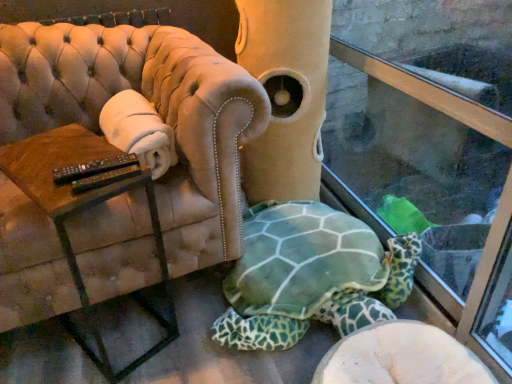
Describe the element at coordinates (84, 209) in the screenshot. I see `brown wooden table at left` at that location.

At what (x,y) coordinates should I click in order to perform the action: click on velvet beige armchair at center. Please return your answer as a coordinate pair (x, y). This screenshot has height=384, width=512. Looking at the image, I should click on (155, 107).

I want to click on green fabric tortoise at center, so click(310, 276).

You are a GUI agent. You are given a task and a screenshot of the screen. Output one action in this format:
    pyautogui.click(x=<x>, y=<y>)
    Task: Click on the brown wooden table at left
    The height and width of the screenshot is (384, 512).
    Given the screenshot: What is the action you would take?
    pyautogui.click(x=84, y=209)

From the image's perspective, which one is positioned lower, green fabric tortoise at center or transparent glass shop window at lower right?

From the image's view, green fabric tortoise at center is below.

From a real-world perspective, is green fabric tortoise at center below transparent glass shop window at lower right?

Yes, from a real-world perspective, green fabric tortoise at center is below transparent glass shop window at lower right.

Is green fabric tortoise at center inside the boundaries of transparent glass shop window at lower right, or outside?

green fabric tortoise at center exists outside the volume of transparent glass shop window at lower right.

Is velvet beige armchair at center positioned in front of transparent glass shop window at lower right?

No, it is not.

Based on the photo, is velvet beige armchair at center aimed at transparent glass shop window at lower right?

No, velvet beige armchair at center is not oriented towards transparent glass shop window at lower right.

Considering the points (120, 84) and (497, 123), which point is behind, point (120, 84) or point (497, 123)?

Positioned behind is point (120, 84).

Considering the sizes of objects velvet beige armchair at center and transparent glass shop window at lower right in the image provided, who is smaller, velvet beige armchair at center or transparent glass shop window at lower right?

With smaller size is transparent glass shop window at lower right.

Based on the photo, does transparent glass shop window at lower right turn towards velvet beige armchair at center?

Yes, transparent glass shop window at lower right is turned towards velvet beige armchair at center.

Looking at the image, does transparent glass shop window at lower right seem bigger or smaller compared to velvet beige armchair at center?

Clearly, transparent glass shop window at lower right is smaller in size than velvet beige armchair at center.

Is transparent glass shop window at lower right touching velvet beige armchair at center?

They are not placed beside each other.

Is transparent glass shop window at lower right to the left or to the right of velvet beige armchair at center in the image?

transparent glass shop window at lower right is to the right of velvet beige armchair at center.

From the image's perspective, is brown wooden table at left above or below green fabric tortoise at center?

brown wooden table at left is situated higher than green fabric tortoise at center in the image.

From a real-world perspective, does brown wooden table at left sit lower than green fabric tortoise at center?

No, from a real-world perspective, brown wooden table at left is not beneath green fabric tortoise at center.

Between brown wooden table at left and green fabric tortoise at center, which one has larger size?

green fabric tortoise at center is bigger.

Measure the distance from brown wooden table at left to green fabric tortoise at center.

brown wooden table at left and green fabric tortoise at center are 20.20 inches apart.

Choose the correct answer: Is green fabric tortoise at center inside velvet beige armchair at center or outside it?

green fabric tortoise at center is spatially situated outside velvet beige armchair at center.

How many degrees apart are the facing directions of green fabric tortoise at center and velvet beige armchair at center?

The angle between the facing direction of green fabric tortoise at center and the facing direction of velvet beige armchair at center is 5.84 degrees.

Is green fabric tortoise at center to the left of velvet beige armchair at center from the viewer's perspective?

In fact, green fabric tortoise at center is to the right of velvet beige armchair at center.

From their relative heights in the image, would you say green fabric tortoise at center is taller or shorter than velvet beige armchair at center?

In the image, green fabric tortoise at center appears to be shorter than velvet beige armchair at center.

Based on the photo, measure the distance between brown wooden table at left and transparent glass shop window at lower right.

A distance of 38.90 inches exists between brown wooden table at left and transparent glass shop window at lower right.

Is brown wooden table at left touching transparent glass shop window at lower right?

No, brown wooden table at left is not in contact with transparent glass shop window at lower right.

Is brown wooden table at left bigger or smaller than transparent glass shop window at lower right?

In the image, brown wooden table at left appears to be larger than transparent glass shop window at lower right.

What's the angular difference between brown wooden table at left and transparent glass shop window at lower right's facing directions?

63.4 degrees.

Is velvet beige armchair at center spatially inside brown wooden table at left, or outside of it?

velvet beige armchair at center lies outside brown wooden table at left.

Between velvet beige armchair at center and brown wooden table at left, which one appears on the left side from the viewer's perspective?

velvet beige armchair at center is more to the left.

Is velvet beige armchair at center directly adjacent to brown wooden table at left?

No, velvet beige armchair at center is not beside brown wooden table at left.

Locate an element on the screen. shop window to the right of green fabric tortoise at center is located at coordinates (426, 92).

Find the location of `shop window positioned vertically above the velvet beige armchair at center (from a real-world perspective)`. shop window positioned vertically above the velvet beige armchair at center (from a real-world perspective) is located at coordinates (426, 92).

Which object lies nearer to the anchor point transparent glass shop window at lower right, brown wooden table at left or velvet beige armchair at center?

velvet beige armchair at center is closer to transparent glass shop window at lower right.

From the picture: Estimate the real-world distances between objects in this image. Which object is closer to velvet beige armchair at center, green fabric tortoise at center or brown wooden table at left?

The object closer to velvet beige armchair at center is brown wooden table at left.

Considering their positions, is transparent glass shop window at lower right positioned closer to green fabric tortoise at center than velvet beige armchair at center?

transparent glass shop window at lower right is positioned closer to the anchor green fabric tortoise at center.

Considering their positions, is brown wooden table at left positioned closer to velvet beige armchair at center than green fabric tortoise at center?

The object closer to velvet beige armchair at center is brown wooden table at left.

Consider the image. Estimate the real-world distances between objects in this image. Which object is closer to brown wooden table at left, velvet beige armchair at center or transparent glass shop window at lower right?

velvet beige armchair at center is closer to brown wooden table at left.

Consider the image. Based on their spatial positions, is brown wooden table at left or velvet beige armchair at center further from green fabric tortoise at center?

brown wooden table at left.

When comparing their distances from green fabric tortoise at center, does brown wooden table at left or transparent glass shop window at lower right seem closer?

transparent glass shop window at lower right.

Looking at the image, which one is located closer to velvet beige armchair at center, brown wooden table at left or transparent glass shop window at lower right?

The object closer to velvet beige armchair at center is brown wooden table at left.

Find the location of a particular element. table between velvet beige armchair at center and transparent glass shop window at lower right in the horizontal direction is located at coordinates (84, 209).

I want to click on table between velvet beige armchair at center and green fabric tortoise at center in the horizontal direction, so click(x=84, y=209).

At what (x,y) coordinates should I click in order to perform the action: click on tortoise located between brown wooden table at left and transparent glass shop window at lower right in the left-right direction. Please return your answer as a coordinate pair (x, y). This screenshot has height=384, width=512. Looking at the image, I should click on (310, 276).

Where is `tortoise between velvet beige armchair at center and transparent glass shop window at lower right`? This screenshot has height=384, width=512. tortoise between velvet beige armchair at center and transparent glass shop window at lower right is located at coordinates (310, 276).